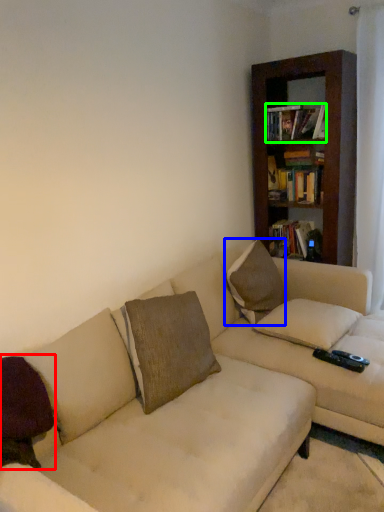
Question: Which object is positioned closest to pillow (highlighted by a red box)? Select from pillow (highlighted by a blue box) and book (highlighted by a green box).

Choices:
 (A) pillow
 (B) book

Answer: (A)